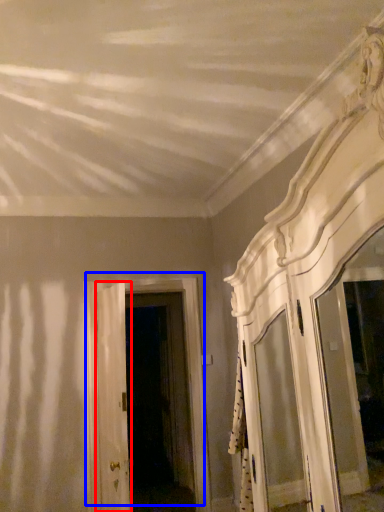
Question: Which object is further to the camera taking this photo, door (highlighted by a red box) or door (highlighted by a blue box)?

Choices:
 (A) door
 (B) door

Answer: (B)